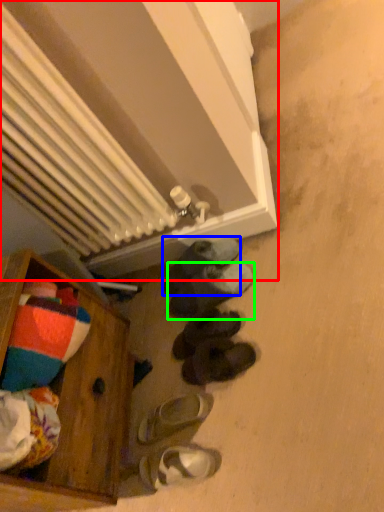
Question: Considering the real-world distances, which object is closest to radiator (highlighted by a red box)? footwear (highlighted by a blue box) or footwear (highlighted by a green box).

Choices:
 (A) footwear
 (B) footwear

Answer: (A)